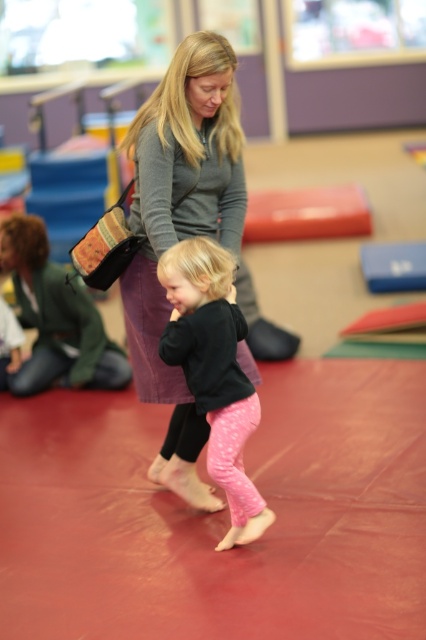
Identify the location of matte gray sweater at center. This screenshot has width=426, height=640. (181, 228).

Who is shorter, matte gray sweater at center or pink textured leggings at center?

With less height is pink textured leggings at center.

Measure the distance between matte gray sweater at center and camera.

They are 3.28 meters apart.

Where is `matte gray sweater at center`? matte gray sweater at center is located at coordinates (181, 228).